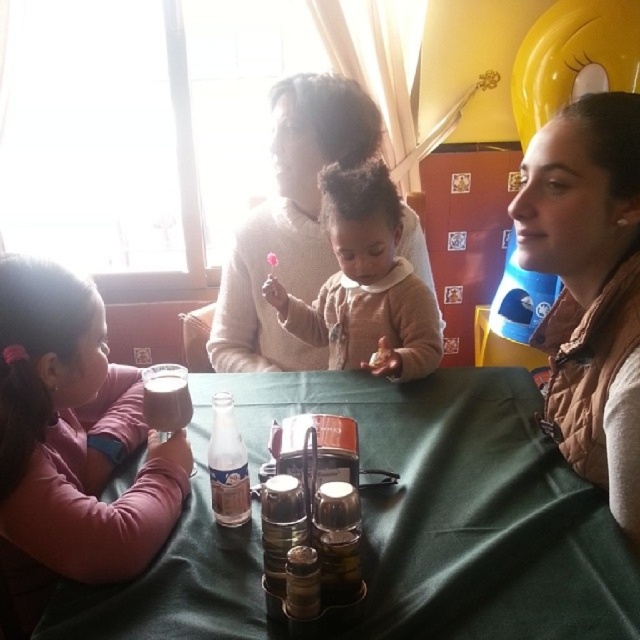
You are a fashion designer observing the clothing items in the scene. Which clothing item, the brown quilted vest at right or the soft beige sweater at center, would you recommend for someone wanting a more compact and less bulky look?

The brown quilted vest at right has a smaller size compared to the soft beige sweater at center, so it would be the better choice for a more compact and less bulky look.

You are standing in front of the green fabric table at center and want to place a 70 cm long object on it. Can you fit it on the table without moving anything?

The green fabric table at center is 68.52 centimeters from viewer, so the 70 cm long object may not fit as it is slightly longer than the table length. Consider moving items or choosing a shorter object.